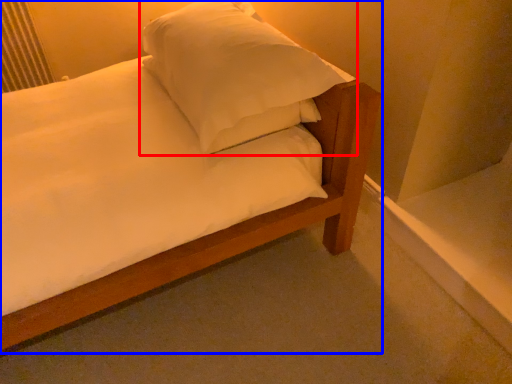
Question: Which of the following is the closest to the observer, pillow (highlighted by a red box) or bed (highlighted by a blue box)?

Choices:
 (A) pillow
 (B) bed

Answer: (A)